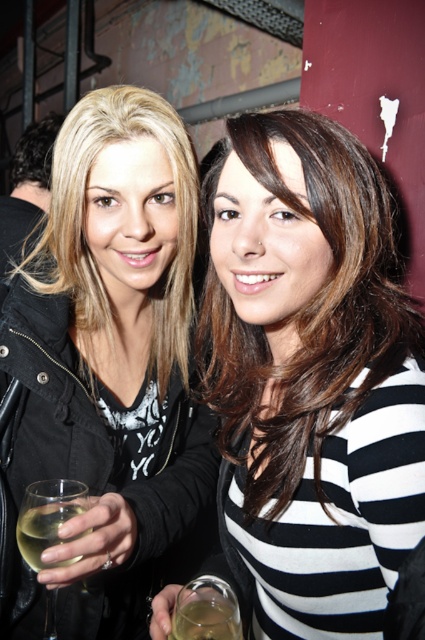
Is black striped shirt at center positioned before matte black jacket at center?

Yes, black striped shirt at center is closer to the viewer.

Describe the element at coordinates (311, 372) in the screenshot. I see `black striped shirt at center` at that location.

This screenshot has width=425, height=640. I want to click on black striped shirt at center, so click(311, 372).

Which of these two, black striped shirt at center or dark brown hair at upper left, stands shorter?

With less height is dark brown hair at upper left.

The image size is (425, 640). Describe the element at coordinates (311, 372) in the screenshot. I see `black striped shirt at center` at that location.

You are a GUI agent. You are given a task and a screenshot of the screen. Output one action in this format:
    pyautogui.click(x=<x>, y=<y>)
    Task: Click on the black striped shirt at center
    The width and height of the screenshot is (425, 640).
    Given the screenshot: What is the action you would take?
    pyautogui.click(x=311, y=372)

Is black striped shirt at center thinner than translucent glass at hand right?

No.

Find the location of a particular element. black striped shirt at center is located at coordinates (311, 372).

What are the coordinates of `black striped shirt at center` in the screenshot? It's located at (311, 372).